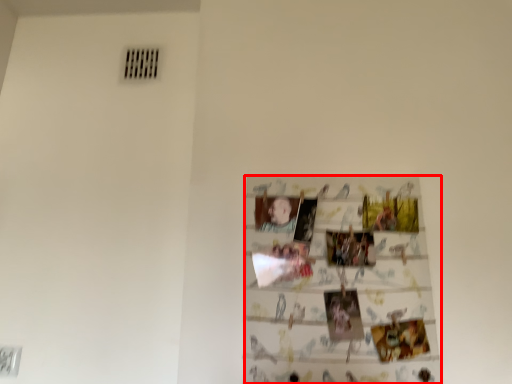
Question: From the image's perspective, where is print (annotated by the red box) located relative to person?

Choices:
 (A) below
 (B) above

Answer: (A)